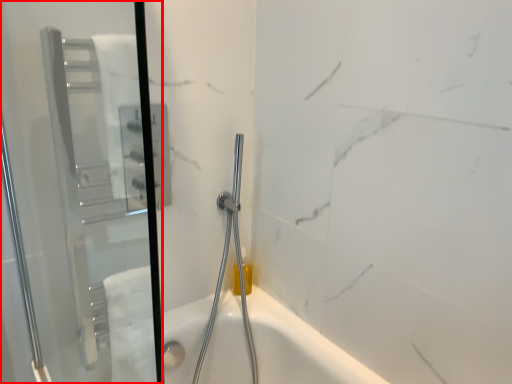
Question: Where is screen door (annotated by the red box) located in relation to shower in the image?

Choices:
 (A) left
 (B) right

Answer: (A)